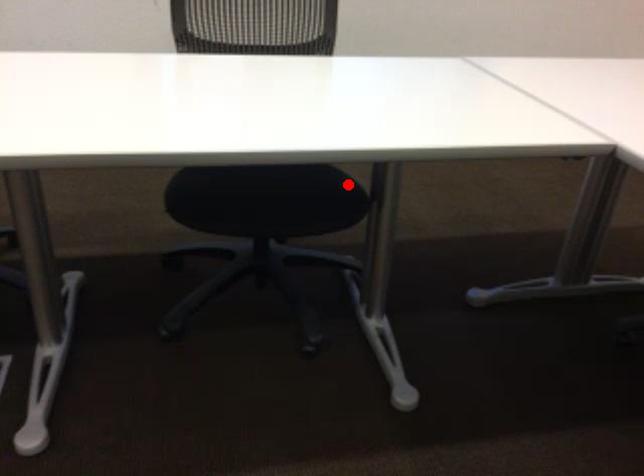
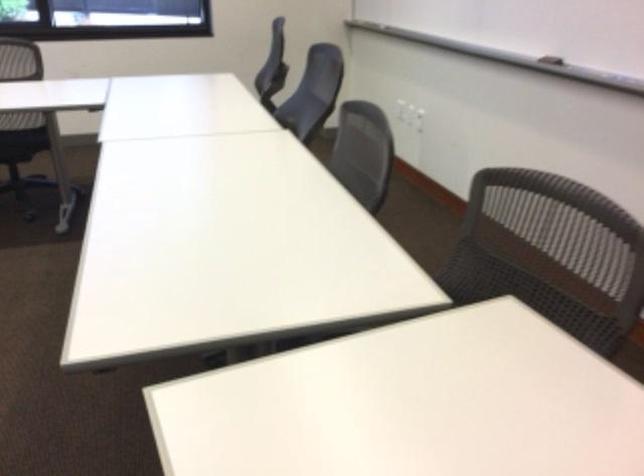
Question: I am providing you with two images of the same scene from different viewpoints. Image1 has a red point marked. In image2, the corresponding 3D location appears at what relative position? Reply with the corresponding letter.

Choices:
 (A) Closer
 (B) Farther

Answer: (B)